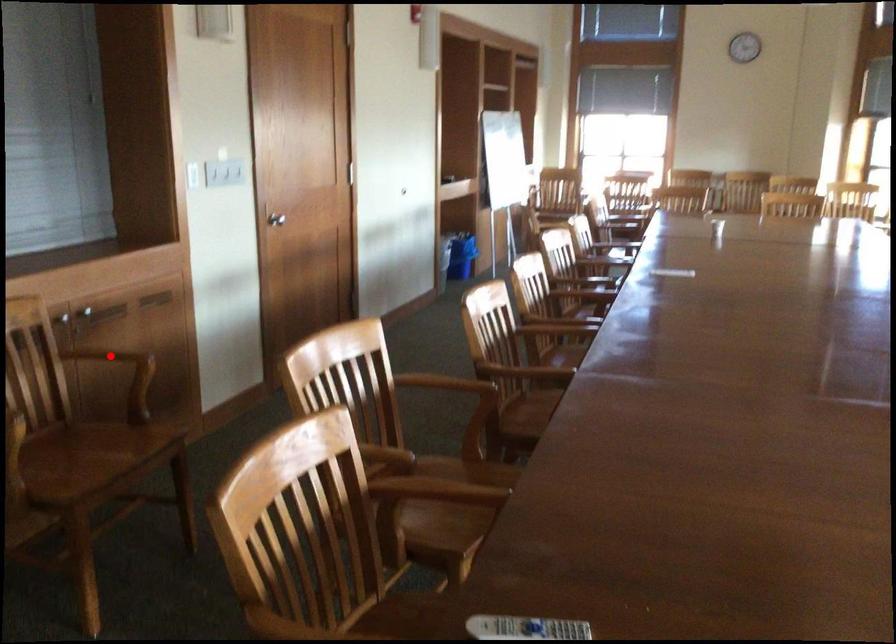
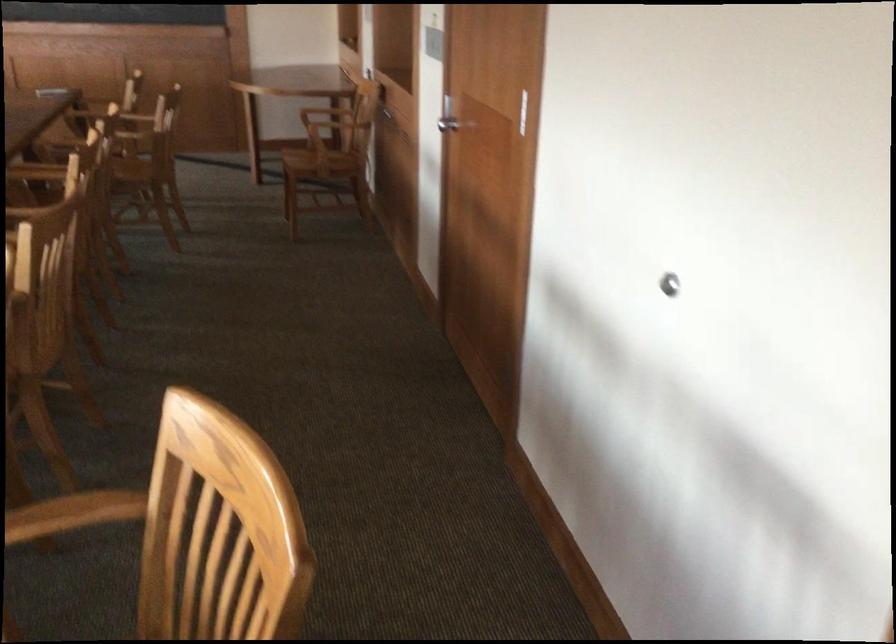
Question: I am providing you with two images of the same scene from different viewpoints. A red point is marked on the first image. Is the red point's position out of view in image 2?

Choices:
 (A) Yes
 (B) No

Answer: (A)